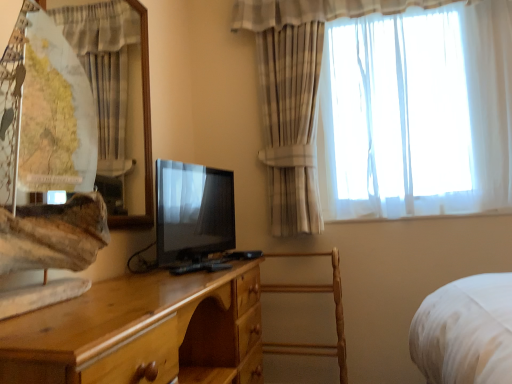
Identify the location of sheer white curtain at upper right, the first curtain in the back-to-front sequence. The image size is (512, 384). (383, 108).

Describe the element at coordinates (138, 330) in the screenshot. I see `light brown wood chest of drawers at center` at that location.

From the picture: Measure the distance between point (179, 366) and camera.

5.17 feet.

Locate an element on the screen. The image size is (512, 384). white sheer curtain at upper left, which is the 1th curtain in front-to-back order is located at coordinates (116, 87).

Where is `matte black tv at center`? This screenshot has width=512, height=384. matte black tv at center is located at coordinates (192, 212).

Locate an element on the screen. sheer white curtain at upper right, marked as the 1th curtain in a right-to-left arrangement is located at coordinates (383, 108).

Image resolution: width=512 pixels, height=384 pixels. Identify the location of curtain on the right of white sheer curtain at upper left, positioned as the 2th curtain in back-to-front order. (383, 108).

Based on the photo, is white sheer curtain at upper left, acting as the first curtain starting from the left, smaller than sheer white curtain at upper right, the second curtain from the left?

Correct, white sheer curtain at upper left, acting as the first curtain starting from the left, occupies less space than sheer white curtain at upper right, the second curtain from the left.

From the image's perspective, which is above, white sheer curtain at upper left, which ranks as the second curtain in right-to-left order, or sheer white curtain at upper right, marked as the 1th curtain in a right-to-left arrangement?

sheer white curtain at upper right, marked as the 1th curtain in a right-to-left arrangement.

In terms of width, does white sheer curtain at upper left, which ranks as the second curtain in right-to-left order, look wider or thinner when compared to sheer white curtain at upper right, the second curtain from the left?

In the image, white sheer curtain at upper left, which ranks as the second curtain in right-to-left order, appears to be more narrow than sheer white curtain at upper right, the second curtain from the left.

Is white sheer curtain at upper left, positioned as the 2th curtain in back-to-front order, positioned with its back to light brown wood chest of drawers at center?

No, white sheer curtain at upper left, positioned as the 2th curtain in back-to-front order, is not facing away from light brown wood chest of drawers at center.

Based on the photo, can you confirm if white sheer curtain at upper left, positioned as the 2th curtain in back-to-front order, is wider than light brown wood chest of drawers at center?

Incorrect, the width of white sheer curtain at upper left, positioned as the 2th curtain in back-to-front order, does not surpass that of light brown wood chest of drawers at center.

From a real-world perspective, which is physically above, white sheer curtain at upper left, which ranks as the second curtain in right-to-left order, or light brown wood chest of drawers at center?

white sheer curtain at upper left, which ranks as the second curtain in right-to-left order, from a real-world perspective.

How many degrees apart are the facing directions of white sheer curtain at upper left, which ranks as the second curtain in right-to-left order, and light brown wood chest of drawers at center?

The angular difference between white sheer curtain at upper left, which ranks as the second curtain in right-to-left order, and light brown wood chest of drawers at center is 1.65 degrees.

From a real-world perspective, does matte black tv at center sit lower than sheer white curtain at upper right, the second curtain from the left?

Indeed, from a real-world perspective, matte black tv at center is positioned beneath sheer white curtain at upper right, the second curtain from the left.

How different are the orientations of matte black tv at center and sheer white curtain at upper right, the second curtain from the left, in degrees?

The angle between the facing direction of matte black tv at center and the facing direction of sheer white curtain at upper right, the second curtain from the left, is 76 degrees.

Is point (233, 201) positioned behind point (309, 168)?

No, it is in front of (309, 168).

Is matte black tv at center oriented towards sheer white curtain at upper right, the second curtain from the left?

No, matte black tv at center is not oriented towards sheer white curtain at upper right, the second curtain from the left.

Between light brown wood chest of drawers at center and matte black tv at center, which one is positioned behind?

matte black tv at center.

Between light brown wood chest of drawers at center and matte black tv at center, which one has less height?

matte black tv at center is shorter.

From the image's perspective, is light brown wood chest of drawers at center positioned above or below matte black tv at center?

light brown wood chest of drawers at center is situated lower than matte black tv at center in the image.

How distant is light brown wood chest of drawers at center from matte black tv at center?

The distance of light brown wood chest of drawers at center from matte black tv at center is 12.84 inches.

From the image's perspective, would you say light brown wood chest of drawers at center is shown under wooden armchair at center?

No, from the image's perspective, light brown wood chest of drawers at center is not below wooden armchair at center.

From their relative heights in the image, would you say light brown wood chest of drawers at center is taller or shorter than wooden armchair at center?

Clearly, light brown wood chest of drawers at center is shorter compared to wooden armchair at center.

From a real-world perspective, which is physically above, light brown wood chest of drawers at center or wooden armchair at center?

From a 3D spatial view, light brown wood chest of drawers at center is above.

Looking at this image, is sheer white curtain at upper right, the second curtain from the left, positioned with its back to wooden armchair at center?

sheer white curtain at upper right, the second curtain from the left, does not have its back to wooden armchair at center.

Based on the photo, is sheer white curtain at upper right, marked as the 1th curtain in a right-to-left arrangement, spatially inside wooden armchair at center, or outside of it?

sheer white curtain at upper right, marked as the 1th curtain in a right-to-left arrangement, is located beyond the bounds of wooden armchair at center.

Which of these two, sheer white curtain at upper right, marked as the 1th curtain in a right-to-left arrangement, or wooden armchair at center, is bigger?

sheer white curtain at upper right, marked as the 1th curtain in a right-to-left arrangement.

Can you confirm if sheer white curtain at upper right, marked as the 1th curtain in a right-to-left arrangement, is wider than wooden armchair at center?

Incorrect, the width of sheer white curtain at upper right, marked as the 1th curtain in a right-to-left arrangement, does not surpass that of wooden armchair at center.

From the picture: Is sheer white curtain at upper right, marked as the 1th curtain in a right-to-left arrangement, at the back of light brown wood chest of drawers at center?

No, sheer white curtain at upper right, marked as the 1th curtain in a right-to-left arrangement, is not at the back of light brown wood chest of drawers at center.

Can you see light brown wood chest of drawers at center touching sheer white curtain at upper right, the first curtain in the back-to-front sequence?

No, light brown wood chest of drawers at center is not in contact with sheer white curtain at upper right, the first curtain in the back-to-front sequence.

Considering the sizes of light brown wood chest of drawers at center and sheer white curtain at upper right, the second curtain from the left, in the image, is light brown wood chest of drawers at center wider or thinner than sheer white curtain at upper right, the second curtain from the left,?

Considering their sizes, light brown wood chest of drawers at center looks broader than sheer white curtain at upper right, the second curtain from the left.

At what (x,y) coordinates should I click in order to perform the action: click on curtain above the white sheer curtain at upper left, which ranks as the second curtain in right-to-left order (from the image's perspective). Please return your answer as a coordinate pair (x, y). This screenshot has width=512, height=384. Looking at the image, I should click on (383, 108).

From the light brown wood chest of drawers at center, count 1st curtains backward and point to it. Please provide its 2D coordinates.

[(116, 87)]

When comparing their distances from matte black tv at center, does light brown wood chest of drawers at center or wooden armchair at center seem further?

wooden armchair at center lies further to matte black tv at center than the other object.

Which object lies further to the anchor point light brown wood chest of drawers at center, white sheer curtain at upper left, acting as the first curtain starting from the left, or sheer white curtain at upper right, the first curtain in the back-to-front sequence?

sheer white curtain at upper right, the first curtain in the back-to-front sequence, lies further to light brown wood chest of drawers at center than the other object.

Estimate the real-world distances between objects in this image. Which object is further from wooden armchair at center, sheer white curtain at upper right, the first curtain in the back-to-front sequence, or light brown wood chest of drawers at center?

sheer white curtain at upper right, the first curtain in the back-to-front sequence, is further to wooden armchair at center.

Estimate the real-world distances between objects in this image. Which object is closer to white sheer curtain at upper left, which ranks as the second curtain in right-to-left order, matte black tv at center or sheer white curtain at upper right, the first curtain in the back-to-front sequence?

Among the two, matte black tv at center is located nearer to white sheer curtain at upper left, which ranks as the second curtain in right-to-left order.

When comparing their distances from matte black tv at center, does white sheer curtain at upper left, acting as the first curtain starting from the left, or light brown wood chest of drawers at center seem further?

Among the two, white sheer curtain at upper left, acting as the first curtain starting from the left, is located further to matte black tv at center.

When comparing their distances from wooden armchair at center, does sheer white curtain at upper right, the second curtain from the left, or matte black tv at center seem closer?

Based on the image, matte black tv at center appears to be nearer to wooden armchair at center.

Looking at this image, when comparing their distances from light brown wood chest of drawers at center, does white sheer curtain at upper left, acting as the first curtain starting from the left, or matte black tv at center seem further?

white sheer curtain at upper left, acting as the first curtain starting from the left, is positioned further to the anchor light brown wood chest of drawers at center.

When comparing their distances from matte black tv at center, does wooden armchair at center or sheer white curtain at upper right, the first curtain in the back-to-front sequence, seem further?

sheer white curtain at upper right, the first curtain in the back-to-front sequence.

Find the location of a particular element. This screenshot has height=384, width=512. television between white sheer curtain at upper left, acting as the first curtain starting from the left, and sheer white curtain at upper right, the first curtain in the back-to-front sequence, in the horizontal direction is located at coordinates click(x=192, y=212).

Find the location of a particular element. The width and height of the screenshot is (512, 384). television between white sheer curtain at upper left, acting as the first curtain starting from the left, and wooden armchair at center, in the vertical direction is located at coordinates (192, 212).

Identify the location of television positioned between light brown wood chest of drawers at center and sheer white curtain at upper right, the first curtain in the back-to-front sequence, from near to far. (192, 212).

In order to click on curtain between sheer white curtain at upper right, the first curtain in the back-to-front sequence, and wooden armchair at center vertically in this screenshot , I will do `click(116, 87)`.